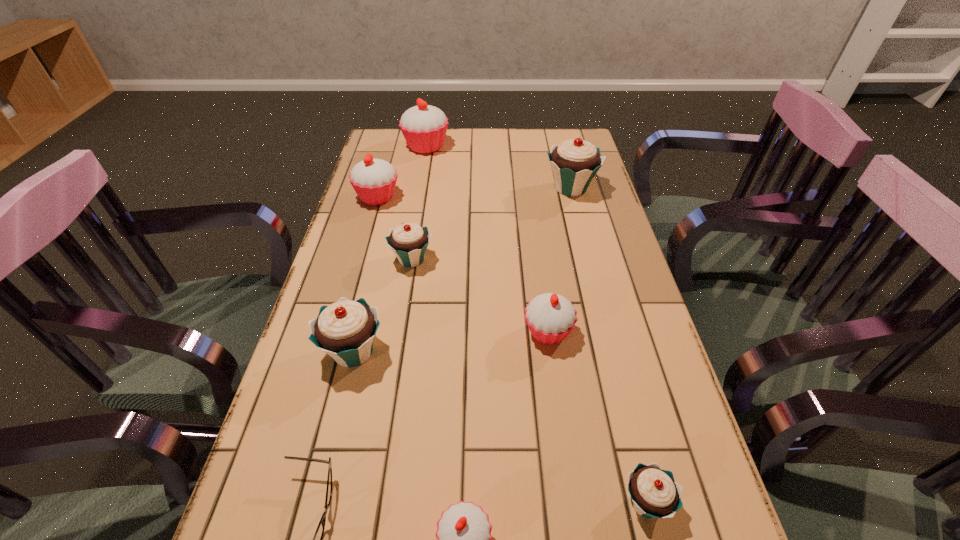
I want to click on free space between the rightmost pink cupcake and the second nearest teal cupcake, so click(450, 342).

Locate which object ranks fourth in proximity to the sixth nearest object. Please provide its 2D coordinates. Your answer should be formatted as a tuple, i.e. [(x, y)], where the tuple contains the x and y coordinates of a point satisfying the conditions above.

[(574, 163)]

What are the coordinates of `object that is the seventh closest to the third farthest pink cupcake` in the screenshot? It's located at (374, 180).

Choose which cupcake is the second nearest neighbor to the third smallest pink cupcake. Please provide its 2D coordinates. Your answer should be formatted as a tuple, i.e. [(x, y)], where the tuple contains the x and y coordinates of a point satisfying the conditions above.

[(424, 127)]

The image size is (960, 540). Identify the location of cupcake that is the fourth closest to the spectacles. (654, 493).

At what (x,y) coordinates should I click in order to perform the action: click on pink cupcake that is the second nearest to the fifth cupcake from left to right. Please return your answer as a coordinate pair (x, y). Looking at the image, I should click on (374, 180).

Select which pink cupcake is the closest to the second biggest teal cupcake. Please provide its 2D coordinates. Your answer should be formatted as a tuple, i.e. [(x, y)], where the tuple contains the x and y coordinates of a point satisfying the conditions above.

[(464, 537)]

Where is `teal cupcake that can be found as the fourth closest to the second farthest pink cupcake`? The image size is (960, 540). teal cupcake that can be found as the fourth closest to the second farthest pink cupcake is located at coordinates (654, 493).

At what (x,y) coordinates should I click in order to perform the action: click on teal cupcake that can be found as the second closest to the nearest teal cupcake. Please return your answer as a coordinate pair (x, y). Looking at the image, I should click on (409, 241).

Identify the location of free space that satisfies the following two spatial constraints: 1. on the back side of the second nearest pink cupcake; 2. on the right side of the biggest teal cupcake. (528, 188).